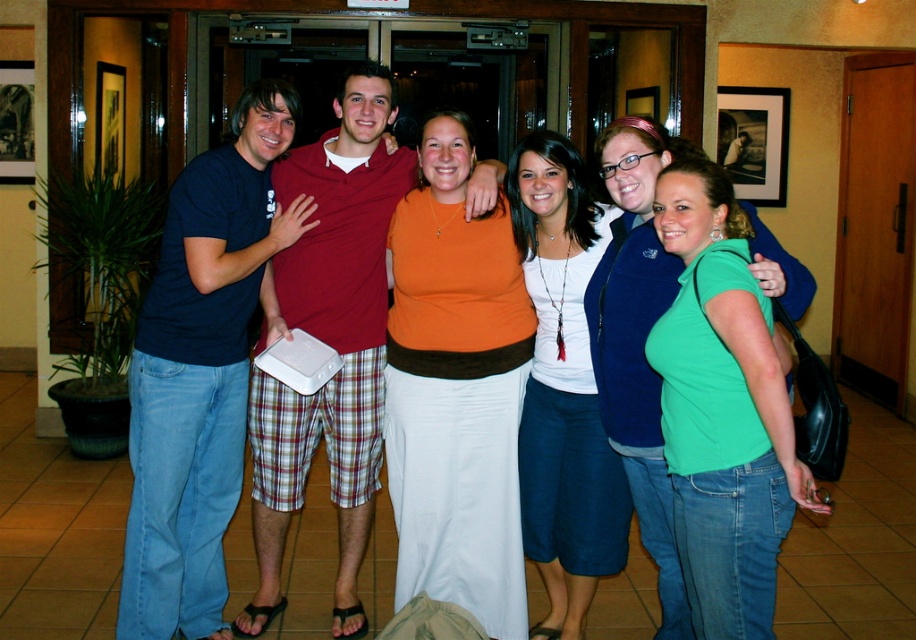
Question: Which point is farther to the camera?

Choices:
 (A) (718, 280)
 (B) (562, 184)

Answer: (B)

Question: Where is orange matte shirt at center located in relation to green matte shirt at center in the image?

Choices:
 (A) above
 (B) below

Answer: (A)

Question: Which is farther from the matte blue jeans at left?

Choices:
 (A) green matte shirt at center
 (B) matte white box at center
 (C) white matte shirt at center

Answer: (A)

Question: From the image, what is the correct spatial relationship of matte white box at center in relation to green matte shirt at center?

Choices:
 (A) left
 (B) right

Answer: (A)

Question: Can you confirm if matte white box at center is positioned to the left of white matte shirt at center?

Choices:
 (A) no
 (B) yes

Answer: (B)

Question: Which is farther from the matte white box at center?

Choices:
 (A) green matte shirt at center
 (B) matte blue jeans at left
 (C) white matte shirt at center

Answer: (A)